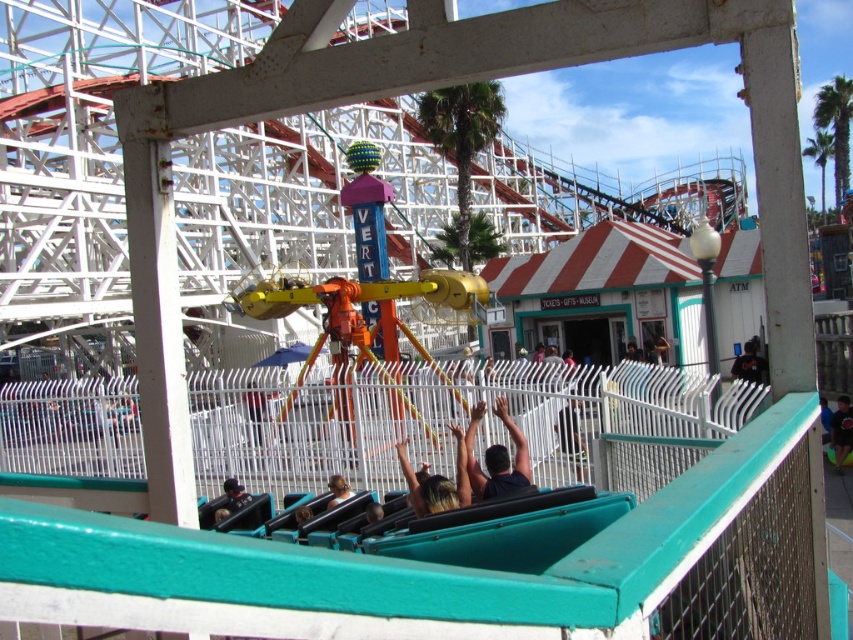
In the scene shown: Is black fabric at lower right thinner than dark blue fabric at lower center?

No.

Looking at this image, is black fabric at lower right positioned before dark blue fabric at lower center?

That is False.

Is point (751, 376) positioned before point (229, 492)?

No, it is behind (229, 492).

Find the location of a particular element. This screenshot has height=640, width=853. black fabric at lower right is located at coordinates (749, 364).

Based on the photo, does blue t-shirt at center appear under light brown leather jacket at lower center?

No.

Does blue t-shirt at center have a greater width compared to light brown leather jacket at lower center?

Yes, blue t-shirt at center is wider than light brown leather jacket at lower center.

At what (x,y) coordinates should I click in order to perform the action: click on blue t-shirt at center. Please return your answer as a coordinate pair (x, y). The height and width of the screenshot is (640, 853). Looking at the image, I should click on (840, 432).

Is dark brown skin at center to the left of blue t-shirt at center from the viewer's perspective?

Yes, dark brown skin at center is to the left of blue t-shirt at center.

Between point (465, 435) and point (850, 442), which one is positioned behind?

Positioned behind is point (850, 442).

Where is `dark brown skin at center`? Image resolution: width=853 pixels, height=640 pixels. dark brown skin at center is located at coordinates (496, 456).